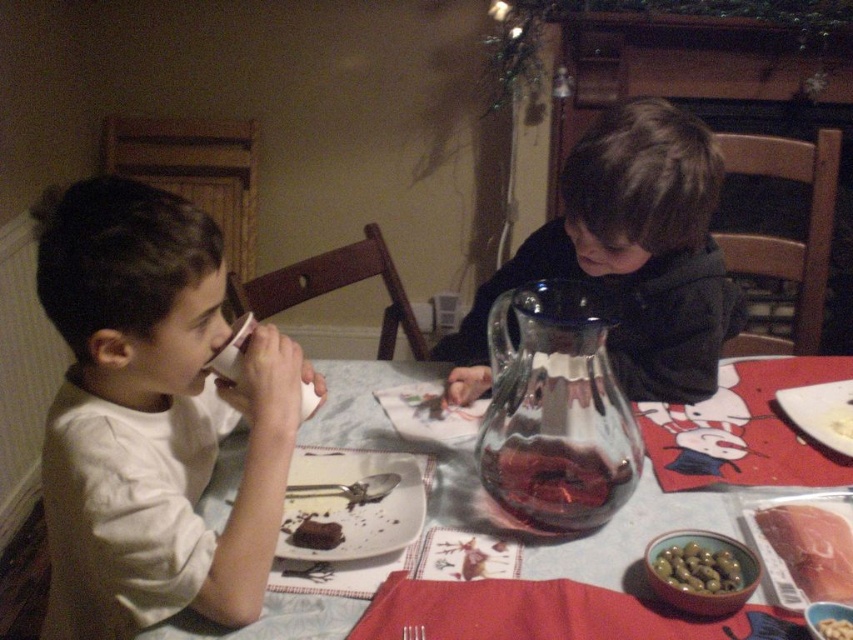
Is the position of transparent glass pitcher at center more distant than that of smooth pink meat at lower right?

Yes, it is.

Is transparent glass pitcher at center shorter than smooth pink meat at lower right?

In fact, transparent glass pitcher at center may be taller than smooth pink meat at lower right.

Is point (573, 376) positioned behind point (830, 529)?

No, (573, 376) is closer to viewer.

What are the coordinates of `transparent glass pitcher at center` in the screenshot? It's located at (556, 410).

Does dark blue fabric jacket at upper right have a lesser width compared to glassy plastic jug at center?

Yes.

Based on the photo, can you confirm if dark blue fabric jacket at upper right is positioned below glassy plastic jug at center?

No.

Is point (699, 205) positioned in front of point (291, 621)?

No, (699, 205) is behind (291, 621).

At what (x,y) coordinates should I click in order to perform the action: click on dark blue fabric jacket at upper right. Please return your answer as a coordinate pair (x, y). Looking at the image, I should click on (628, 256).

Identify the location of white matte cup at left. The height and width of the screenshot is (640, 853). (152, 417).

Describe the element at coordinates (152, 417) in the screenshot. I see `white matte cup at left` at that location.

The width and height of the screenshot is (853, 640). Find the location of `white matte cup at left`. white matte cup at left is located at coordinates (152, 417).

The height and width of the screenshot is (640, 853). Identify the location of white matte cup at left. (152, 417).